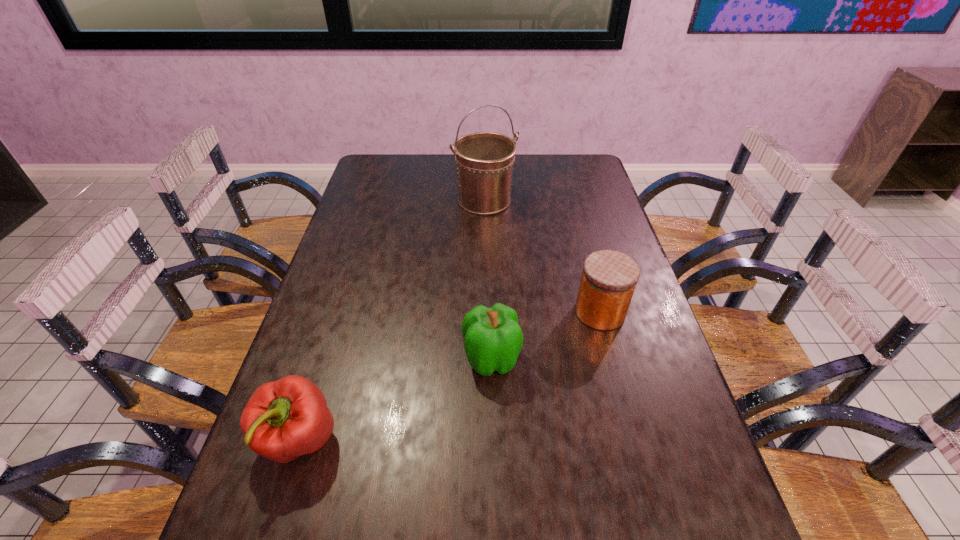
The image size is (960, 540). In order to click on vacant area between the bucket and the third nearest object in this screenshot , I will do `click(542, 256)`.

The height and width of the screenshot is (540, 960). What are the coordinates of `free space between the jar and the farthest object` in the screenshot? It's located at (542, 256).

Where is `free space that is in between the leftmost object and the farthest object`? This screenshot has width=960, height=540. free space that is in between the leftmost object and the farthest object is located at coordinates (392, 320).

The image size is (960, 540). I want to click on free space between the rightmost object and the third farthest object, so click(x=545, y=335).

At what (x,y) coordinates should I click in order to perform the action: click on free space between the jar and the second nearest object. Please return your answer as a coordinate pair (x, y). Looking at the image, I should click on (545, 335).

Where is `unoccupied position between the third farthest object and the left bell pepper`? This screenshot has height=540, width=960. unoccupied position between the third farthest object and the left bell pepper is located at coordinates (396, 400).

At what (x,y) coordinates should I click in order to perform the action: click on free spot between the nearer bell pepper and the farthest object. Please return your answer as a coordinate pair (x, y). The height and width of the screenshot is (540, 960). Looking at the image, I should click on (392, 320).

Where is `free point between the nearest object and the tallest object`? The width and height of the screenshot is (960, 540). free point between the nearest object and the tallest object is located at coordinates (392, 320).

You are a GUI agent. You are given a task and a screenshot of the screen. Output one action in this format:
    pyautogui.click(x=<x>, y=<y>)
    Task: Click on the object that can be found as the third closest to the tallest object
    
    Given the screenshot: What is the action you would take?
    pyautogui.click(x=284, y=419)

Select which object appears as the closest to the left bell pepper. Please provide its 2D coordinates. Your answer should be formatted as a tuple, i.e. [(x, y)], where the tuple contains the x and y coordinates of a point satisfying the conditions above.

[(493, 339)]